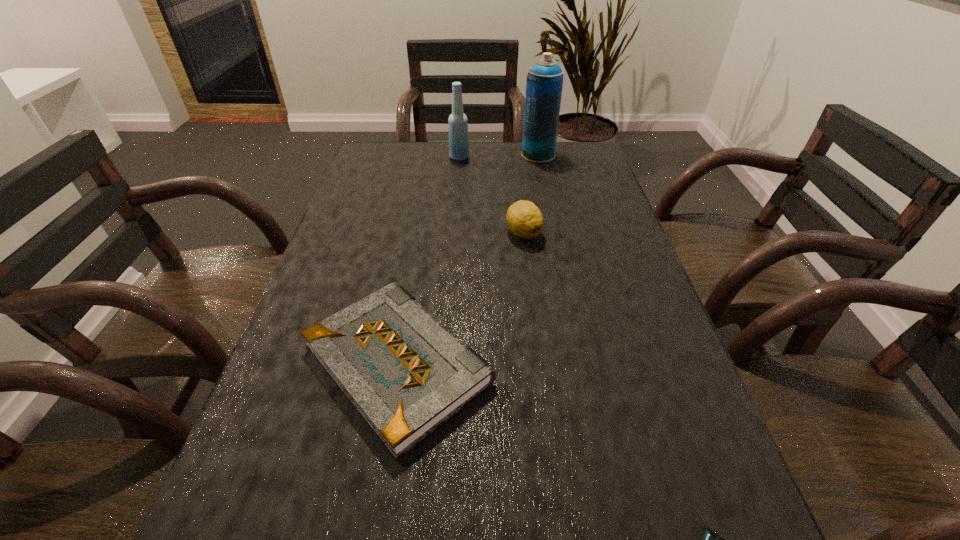
The width and height of the screenshot is (960, 540). I want to click on aerosol can located at the far edge, so click(x=544, y=84).

The width and height of the screenshot is (960, 540). Find the location of `bottle at the far edge`. bottle at the far edge is located at coordinates (458, 123).

Identify the location of object situated at the left edge. (406, 374).

Find the location of a particular element. object at the right edge is located at coordinates (544, 84).

This screenshot has width=960, height=540. What are the coordinates of `object located at the far right corner` in the screenshot? It's located at (544, 84).

This screenshot has height=540, width=960. I want to click on free space at the far edge, so click(x=422, y=155).

I want to click on free space at the left edge, so click(x=317, y=501).

At what (x,y) coordinates should I click in order to perform the action: click on vacant space at the right edge of the desktop. Please return your answer as a coordinate pair (x, y). The height and width of the screenshot is (540, 960). Looking at the image, I should click on (619, 273).

This screenshot has height=540, width=960. What are the coordinates of `free space at the far right corner of the desktop` in the screenshot? It's located at (575, 164).

Where is `vacant space that is in between the bottle and the tallest object`? Image resolution: width=960 pixels, height=540 pixels. vacant space that is in between the bottle and the tallest object is located at coordinates (499, 156).